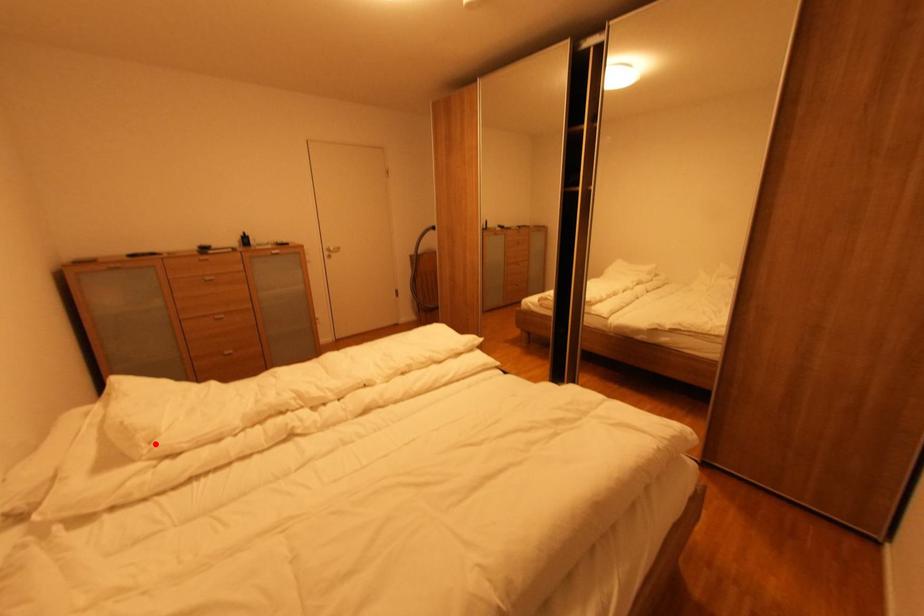
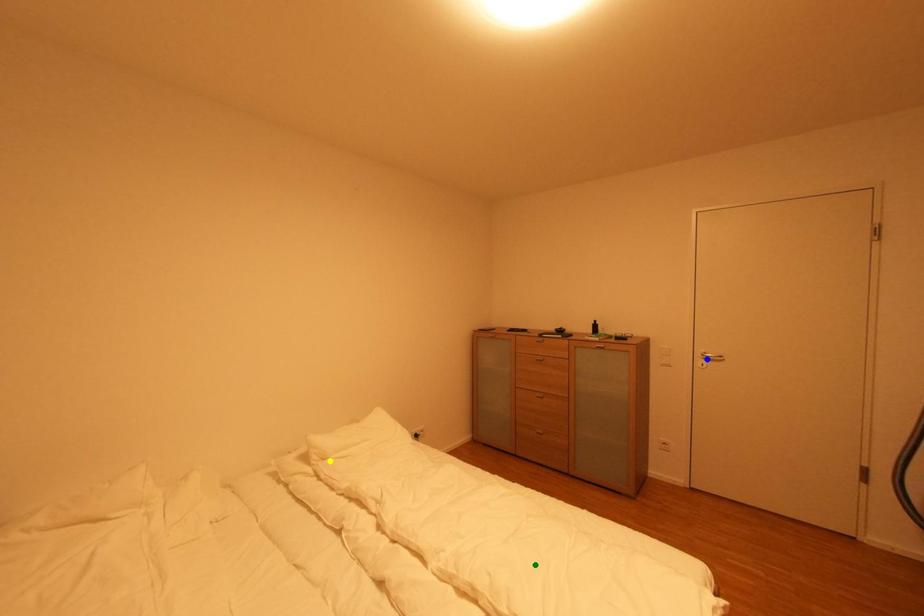
Question: I am providing you with two images of the same scene from different viewpoints. A red point is marked on the first image. You are given multiple points on the second image. Which spot in image 2 lines up with the point in image 1?

Choices:
 (A) yellow point
 (B) green point
 (C) blue point

Answer: (A)